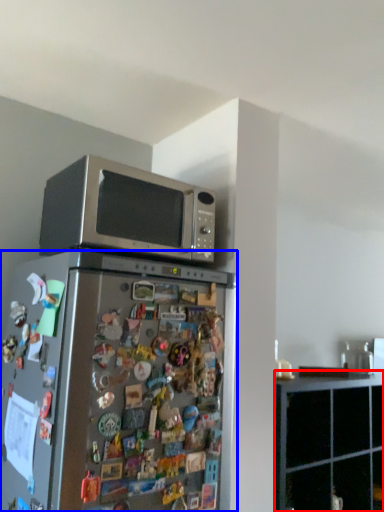
Question: Which object appears farthest to the camera in this image, cabinetry (highlighted by a red box) or refrigerator (highlighted by a blue box)?

Choices:
 (A) cabinetry
 (B) refrigerator

Answer: (A)